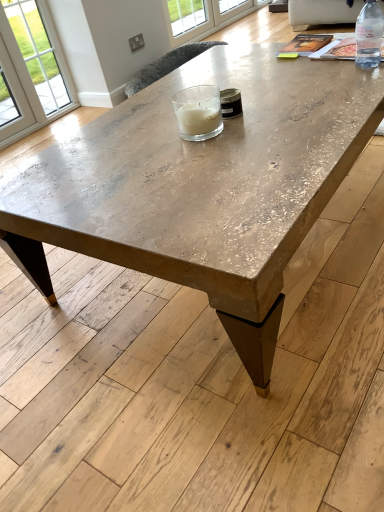
Identify the location of vacant point to the right of clear glass candle at center. The width and height of the screenshot is (384, 512). (263, 128).